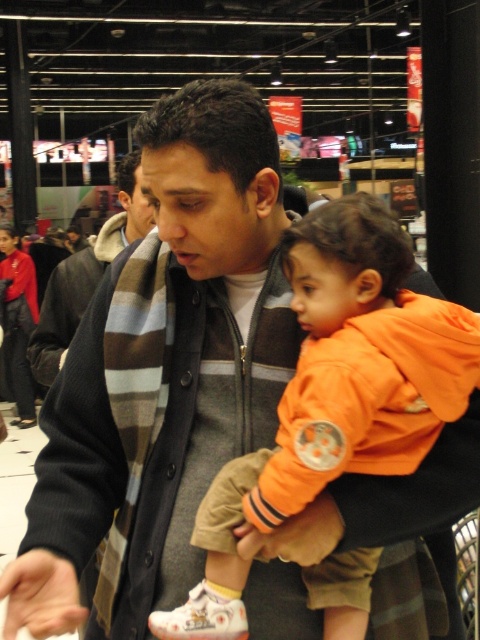
Question: Which point appears closest to the camera in this image?

Choices:
 (A) (317, 332)
 (B) (60, 333)

Answer: (A)

Question: Does orange fleece jacket at center have a larger size compared to striped wool scarf at center?

Choices:
 (A) yes
 (B) no

Answer: (B)

Question: Does orange fleece jacket at center appear on the left side of striped wool scarf at center?

Choices:
 (A) yes
 (B) no

Answer: (B)

Question: Is orange fleece jacket at center bigger than striped wool scarf at center?

Choices:
 (A) yes
 (B) no

Answer: (B)

Question: Which object appears farthest from the camera in this image?

Choices:
 (A) striped wool scarf at center
 (B) orange fleece jacket at center

Answer: (A)